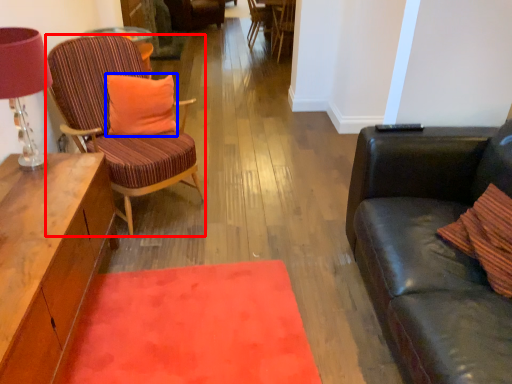
Question: Which object is closer to the camera taking this photo, chair (highlighted by a red box) or pillow (highlighted by a blue box)?

Choices:
 (A) chair
 (B) pillow

Answer: (A)